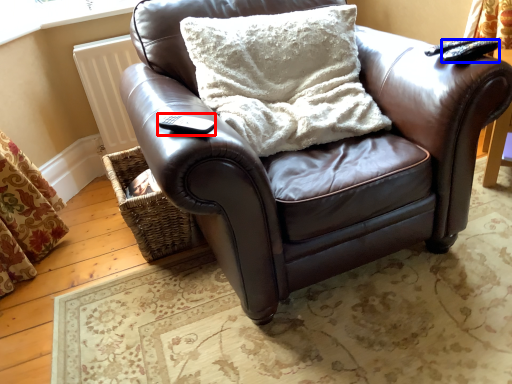
Question: Which object is further to the camera taking this photo, remote (highlighted by a red box) or remote (highlighted by a blue box)?

Choices:
 (A) remote
 (B) remote

Answer: (B)